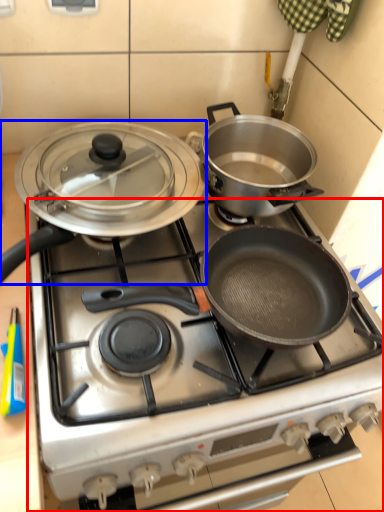
Question: Which of the following is the farthest to the observer, gas stove (highlighted by a red box) or kitchen appliance (highlighted by a blue box)?

Choices:
 (A) gas stove
 (B) kitchen appliance

Answer: (B)